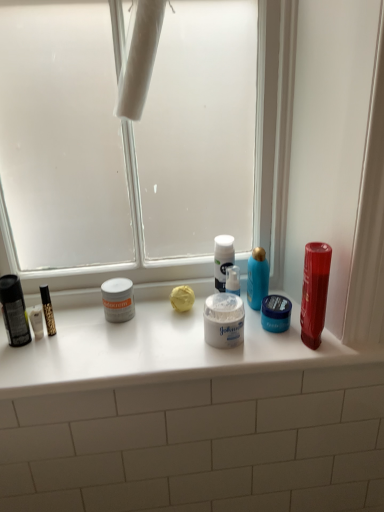
Find the location of a particular element. Image resolution: width=384 pixels, height=512 pixels. free location in front of blue matte jar at center, which is the first toiletry in right-to-left order is located at coordinates [282, 350].